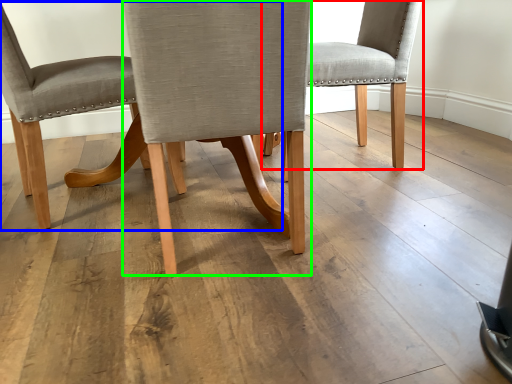
Question: Which is farther away from chair (highlighted by a red box)? chair (highlighted by a blue box) or chair (highlighted by a green box)?

Choices:
 (A) chair
 (B) chair

Answer: (A)